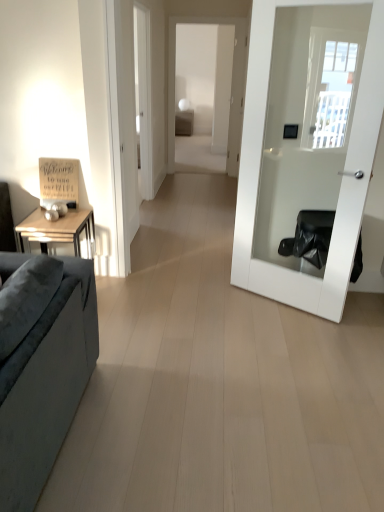
This screenshot has width=384, height=512. What are the coordinates of `matte brown table at center` in the screenshot? It's located at (184, 122).

You are a GUI agent. You are given a task and a screenshot of the screen. Output one action in this format:
    pyautogui.click(x=<x>, y=<y>)
    Task: Click on the matte brown table at center
    This screenshot has height=512, width=384.
    Given the screenshot: What is the action you would take?
    pyautogui.click(x=184, y=122)

Is white glossy door at right positioned with its back to matte brown table at center?

white glossy door at right is not turned away from matte brown table at center.

From a real-world perspective, is white glossy door at right above or below matte brown table at center?

Clearly, from a real-world perspective, white glossy door at right is above matte brown table at center.

What's the angular difference between white glossy door at right and matte brown table at center's facing directions?

They differ by 31 degrees in their facing directions.

Can you confirm if white glossy door at right is shorter than matte brown table at center?

No.

You are a GUI agent. You are given a task and a screenshot of the screen. Output one action in this format:
    pyautogui.click(x=<x>, y=<y>)
    Task: Click on the table above the suede-like gray couch at left (from the image's perspective)
    
    Given the screenshot: What is the action you would take?
    pyautogui.click(x=184, y=122)

Can we say matte brown table at center lies outside suede-like gray couch at left?

That's correct, matte brown table at center is outside of suede-like gray couch at left.

Consider the image. From a real-world perspective, which object rests below the other?

suede-like gray couch at left is physically lower.

Which object is closer to the camera taking this photo, matte brown table at center or suede-like gray couch at left?

suede-like gray couch at left.

This screenshot has width=384, height=512. What are the coordinates of `door above the suede-like gray couch at left (from a real-world perspective)` in the screenshot? It's located at (342, 179).

Is white glossy door at right positioned before suede-like gray couch at left?

No, white glossy door at right is further to the viewer.

Is white glossy door at right smaller than suede-like gray couch at left?

Yes, white glossy door at right is smaller than suede-like gray couch at left.

Looking at their sizes, would you say white glossy door at right is wider or thinner than suede-like gray couch at left?

In the image, white glossy door at right appears to be more narrow than suede-like gray couch at left.

Looking at this image, how distant is matte brown table at center from white glossy door at right?

The distance of matte brown table at center from white glossy door at right is 7.30 meters.

In the image, is matte brown table at center positioned in front of or behind white glossy door at right?

matte brown table at center is behind white glossy door at right.

Is matte brown table at center beside white glossy door at right?

No, matte brown table at center is not with white glossy door at right.

In the scene shown: Between matte brown table at center and white glossy door at right, which one has smaller size?

Smaller between the two is white glossy door at right.

Is suede-like gray couch at left touching matte brown table at center?

No, suede-like gray couch at left is not next to matte brown table at center.

Does point (51, 457) come closer to viewer compared to point (188, 111)?

Yes, it is in front of point (188, 111).

Looking at this image, can we say suede-like gray couch at left lies outside matte brown table at center?

Absolutely, suede-like gray couch at left is external to matte brown table at center.

How many degrees apart are the facing directions of suede-like gray couch at left and matte brown table at center?

suede-like gray couch at left and matte brown table at center are facing 89.9 degrees away from each other.

This screenshot has width=384, height=512. Identify the location of studio couch in front of the white glossy door at right. (46, 386).

From a real-world perspective, relative to white glossy door at right, is suede-like gray couch at left vertically above or below?

Clearly, from a real-world perspective, suede-like gray couch at left is below white glossy door at right.

Who is bigger, suede-like gray couch at left or white glossy door at right?

suede-like gray couch at left.

From the image's perspective, is suede-like gray couch at left above or below white glossy door at right?

suede-like gray couch at left is situated lower than white glossy door at right in the image.

Locate an element on the screen. table below the white glossy door at right (from a real-world perspective) is located at coordinates (184, 122).

What are the coordinates of `studio couch below the matte brown table at center (from the image's perspective)` in the screenshot? It's located at (46, 386).

Looking at the image, which one is located further to suede-like gray couch at left, matte brown table at center or white glossy door at right?

matte brown table at center.

Considering their positions, is white glossy door at right positioned further to suede-like gray couch at left than matte brown table at center?

Among the two, matte brown table at center is located further to suede-like gray couch at left.

When comparing their distances from white glossy door at right, does matte brown table at center or suede-like gray couch at left seem closer?

suede-like gray couch at left is positioned closer to the anchor white glossy door at right.

When comparing their distances from matte brown table at center, does white glossy door at right or suede-like gray couch at left seem further?

suede-like gray couch at left is positioned further to the anchor matte brown table at center.

Looking at the image, which one is located further to matte brown table at center, suede-like gray couch at left or white glossy door at right?

Based on the image, suede-like gray couch at left appears to be further to matte brown table at center.

Estimate the real-world distances between objects in this image. Which object is further from white glossy door at right, suede-like gray couch at left or matte brown table at center?

matte brown table at center.

What are the coordinates of `door positioned between suede-like gray couch at left and matte brown table at center from near to far` in the screenshot? It's located at (342, 179).